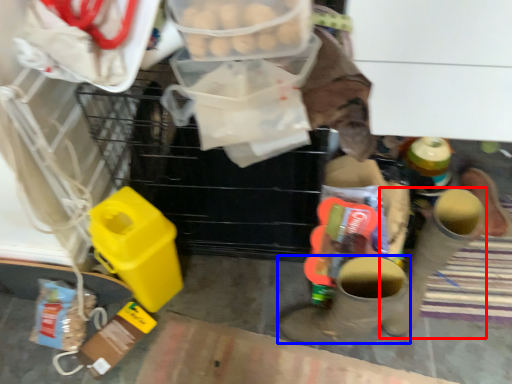
Question: Which point is further to the camera, footwear (highlighted by a red box) or footwear (highlighted by a blue box)?

Choices:
 (A) footwear
 (B) footwear

Answer: (A)